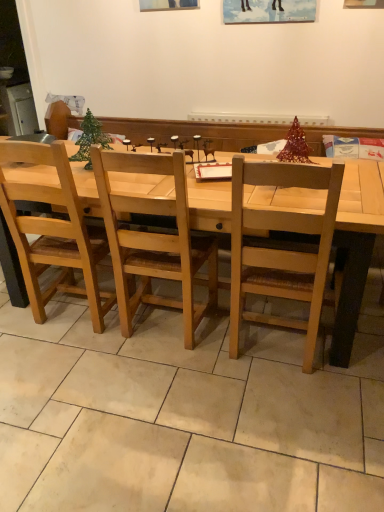
The image size is (384, 512). I want to click on unoccupied area in front of light brown wood chair at center, the first chair positioned from the left, so click(66, 362).